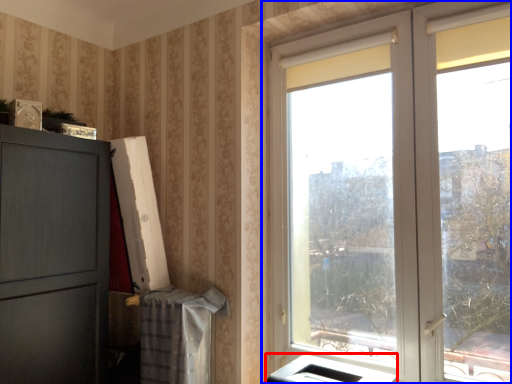
Question: Which object appears closest to the camera in this image, appliance (highlighted by a red box) or window (highlighted by a blue box)?

Choices:
 (A) appliance
 (B) window

Answer: (B)